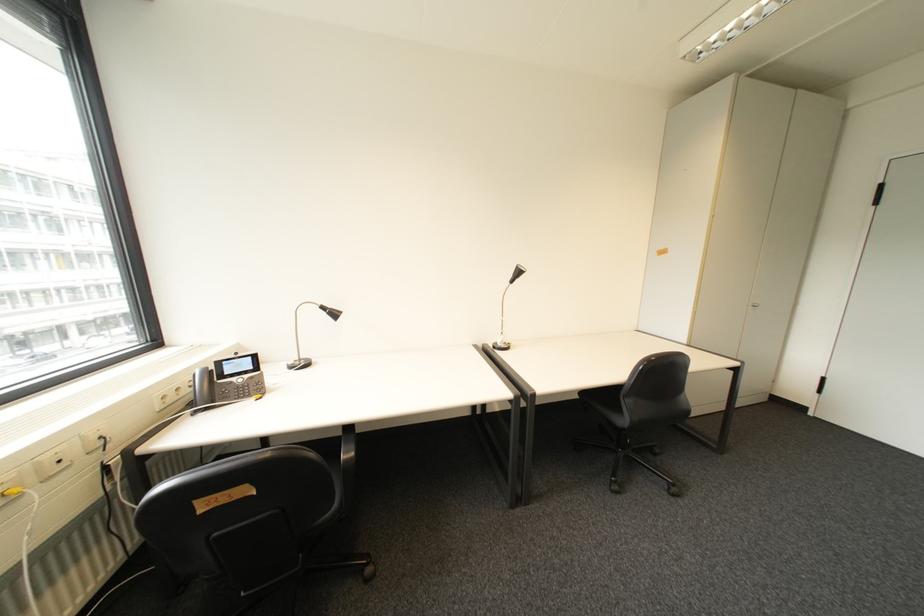
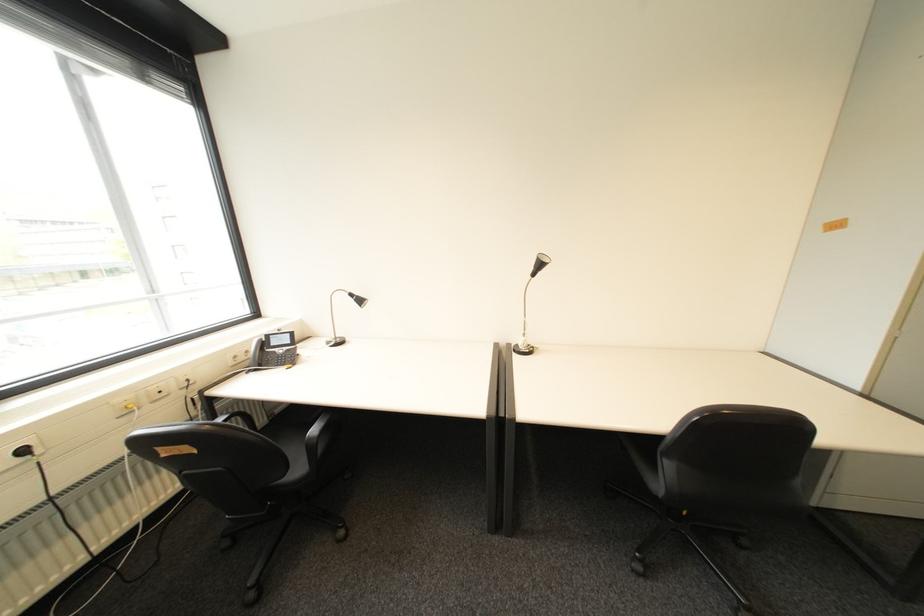
In the second image, find the point that corresponds to pixel 357 461 in the first image.

(321, 439)